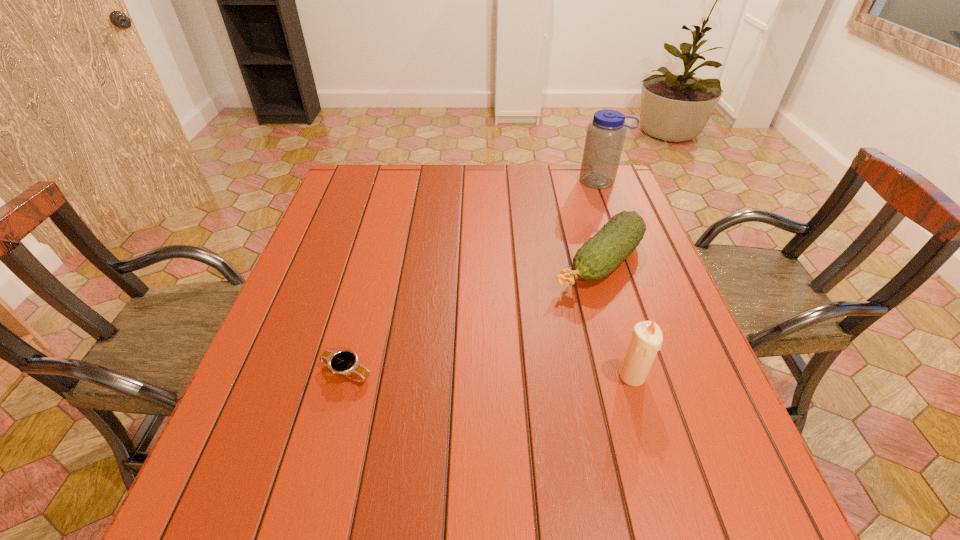
Locate an element on the screen. Image resolution: width=960 pixels, height=540 pixels. watch is located at coordinates (344, 362).

Find the location of a particular element. This screenshot has width=960, height=540. the shortest object is located at coordinates (344, 362).

This screenshot has width=960, height=540. I want to click on candle, so click(646, 341).

The height and width of the screenshot is (540, 960). What are the coordinates of `the farthest object` in the screenshot? It's located at (605, 136).

This screenshot has width=960, height=540. I want to click on water bottle, so click(605, 136).

Identify the location of cucumber. (599, 256).

Locate an element on the screen. This screenshot has height=540, width=960. the second shortest object is located at coordinates (599, 256).

Find the location of a particular element. free space located on the right of the watch is located at coordinates (573, 373).

In order to click on free region located 0.140m on the left of the candle in this screenshot , I will do `click(548, 376)`.

In order to click on free space located 0.070m with a carrying loop on the side of the tallest object in this screenshot , I will do `click(586, 200)`.